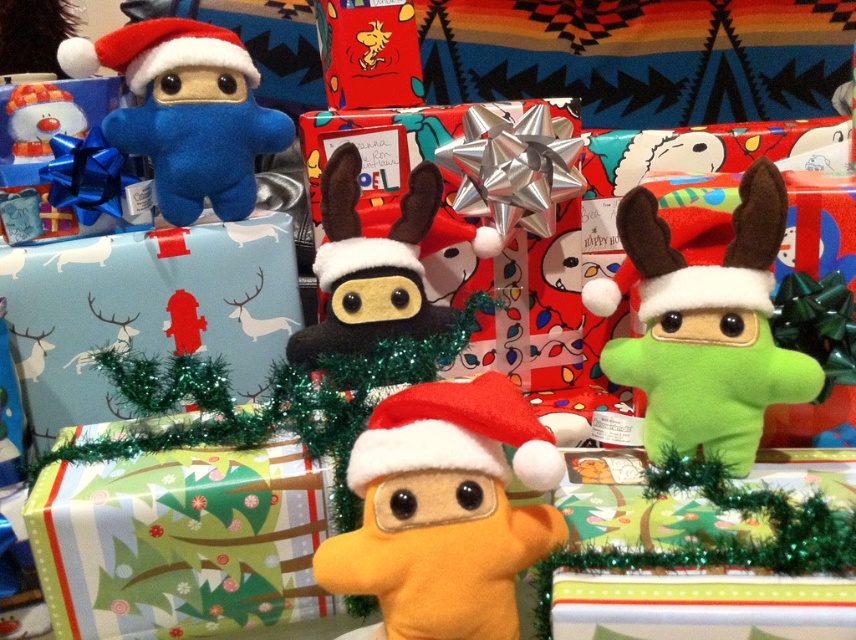
You are a child who wants to choose a toy to play with. You see the felt ninja at center and the matte blue plush toy at upper left. Which one is taller?

The felt ninja at center is taller than the matte blue plush toy at upper left.

You are a child who wants to grab the felt ninja at center from where you are standing. Can you reach it without moving your feet? Your arms can extend 70 centimeters.

The felt ninja at center is 86.73 centimeters away from the viewer, which is farther than the child can reach with their arms extended to 70 centimeters. Therefore, the child cannot reach the felt ninja at center without moving closer.